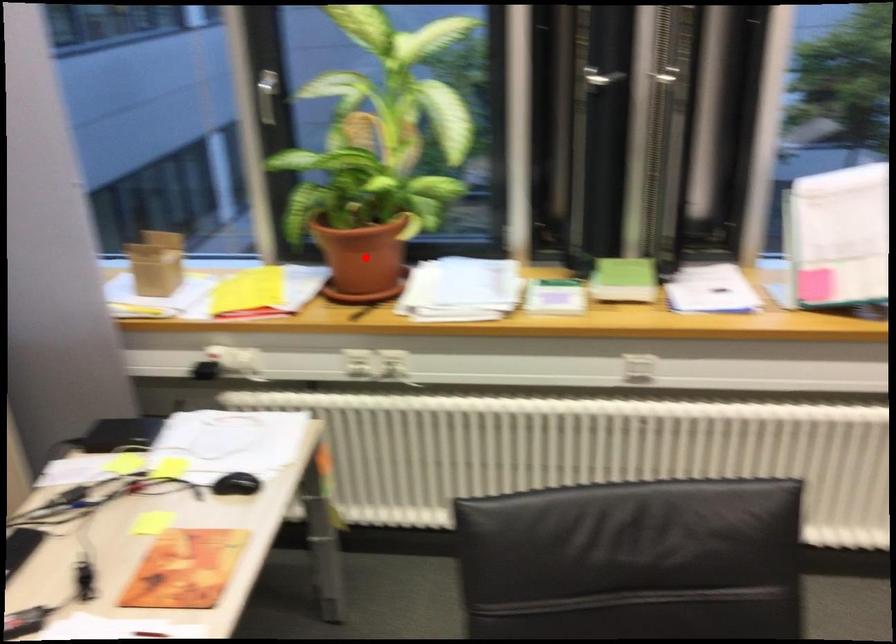
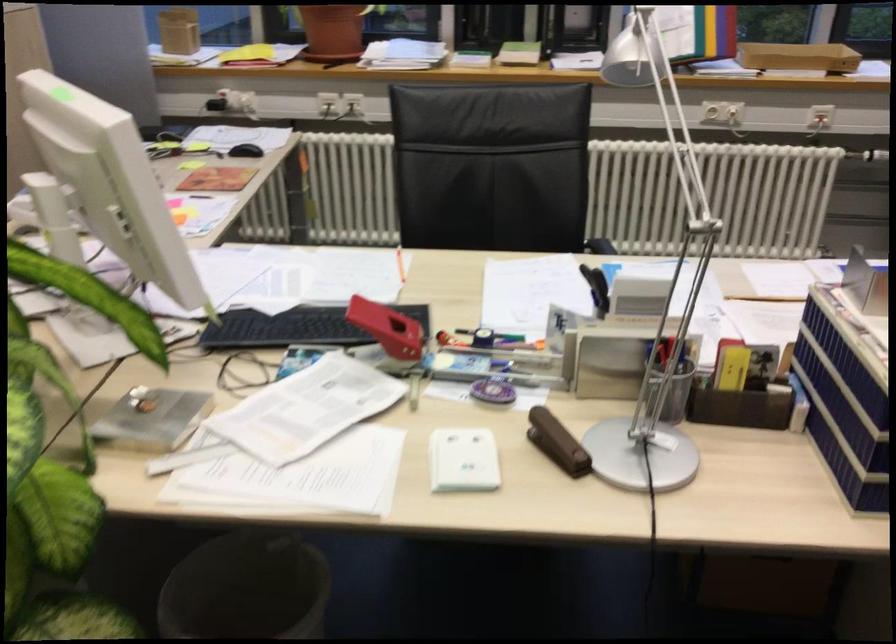
Question: I am providing you with two images of the same scene from different viewpoints. Given a red point in image1, look at the same physical point in image2. Is it:

Choices:
 (A) Closer to the viewpoint
 (B) Farther from the viewpoint

Answer: (B)